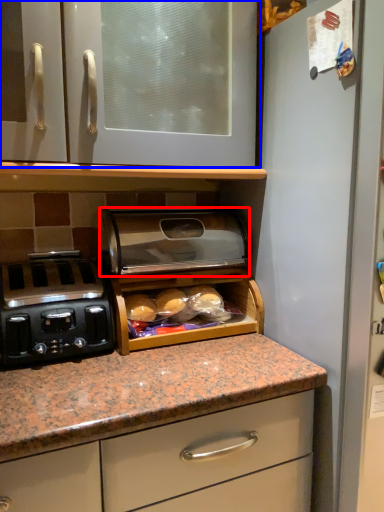
Question: Among these objects, which one is nearest to the camera, appliance (highlighted by a red box) or cabinetry (highlighted by a blue box)?

Choices:
 (A) appliance
 (B) cabinetry

Answer: (B)